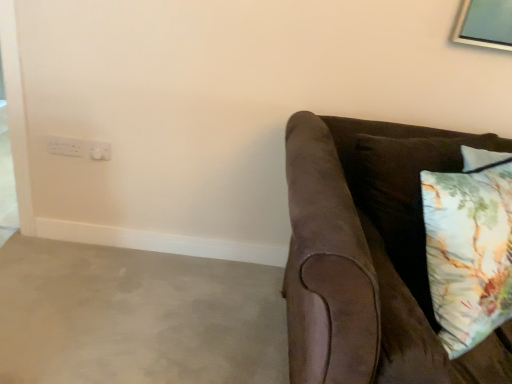
Question: In the image, is white plastic electric outlet at upper left, positioned as the second electric outlet in left-to-right order, positioned in front of or behind floral cotton pillow at right?

Choices:
 (A) front
 (B) behind

Answer: (B)

Question: From a real-world perspective, relative to floral cotton pillow at right, is white plastic electric outlet at upper left, positioned as the second electric outlet in left-to-right order, vertically above or below?

Choices:
 (A) below
 (B) above

Answer: (A)

Question: Which object is positioned closest to the suede brown couch at right?

Choices:
 (A) gray concrete at lower left
 (B) white plastic electrical outlet at upper left, the 1th electric outlet in the left-to-right sequence
 (C) floral cotton pillow at right
 (D) white plastic electric outlet at upper left, the first electric outlet viewed from the right

Answer: (C)

Question: Estimate the real-world distances between objects in this image. Which object is closer to the suede brown couch at right?

Choices:
 (A) white plastic electric outlet at upper left, positioned as the second electric outlet in left-to-right order
 (B) gray concrete at lower left
 (C) floral cotton pillow at right
 (D) white plastic electrical outlet at upper left, the 1th electric outlet in the left-to-right sequence

Answer: (C)